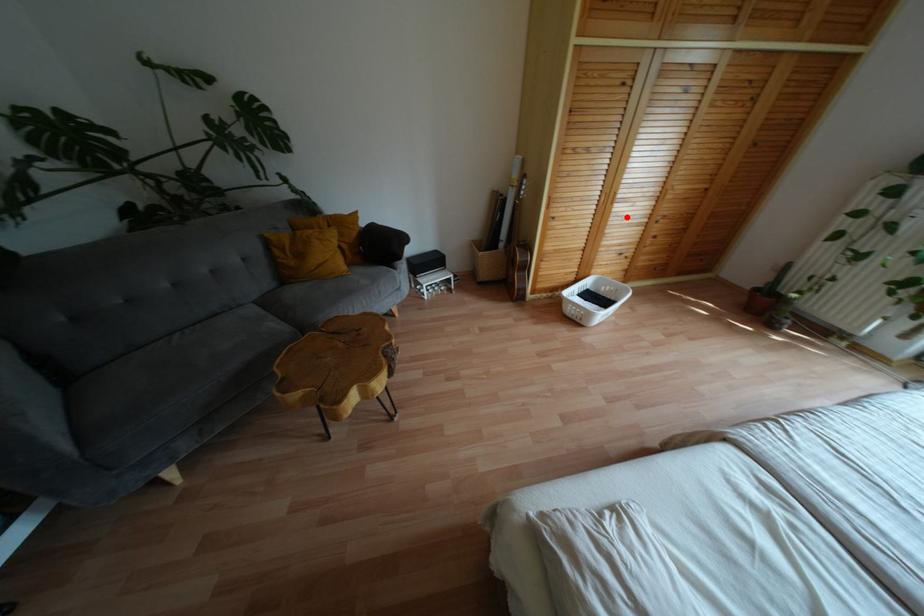
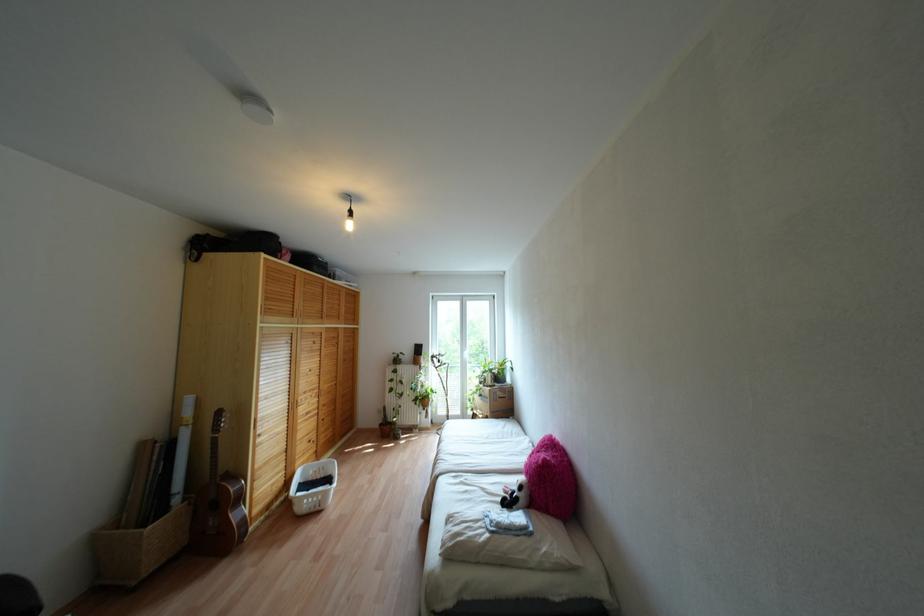
The point at the highlighted location is marked in the first image. Where is the corresponding point in the second image?

(307, 413)